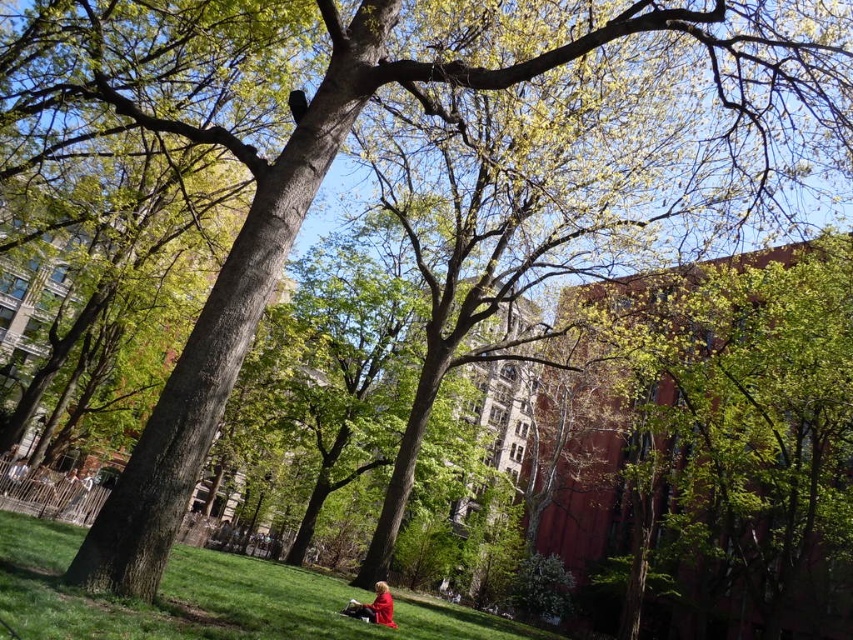
Question: Which object is positioned farthest from the green grass at lower center?

Choices:
 (A) green leafy tree at upper right
 (B) red fabric person at lower center

Answer: (A)

Question: Does green leafy tree at upper right appear on the left side of green grass at lower center?

Choices:
 (A) yes
 (B) no

Answer: (B)

Question: Is green leafy tree at upper right to the right of red fabric person at lower center from the viewer's perspective?

Choices:
 (A) yes
 (B) no

Answer: (A)

Question: Does green grass at lower center appear on the left side of red fabric person at lower center?

Choices:
 (A) yes
 (B) no

Answer: (A)

Question: Which of the following is the farthest from the observer?

Choices:
 (A) (788, 292)
 (B) (132, 632)
 (C) (386, 589)

Answer: (A)

Question: Which point is closer to the camera taking this photo?

Choices:
 (A) (372, 604)
 (B) (780, 576)
 (C) (265, 600)

Answer: (C)